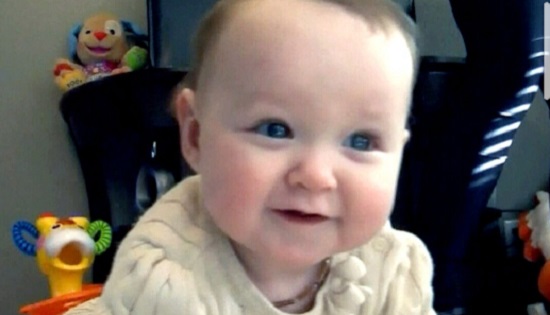
Find the location of a particular element. The height and width of the screenshot is (315, 550). furniture is located at coordinates coord(126,128).